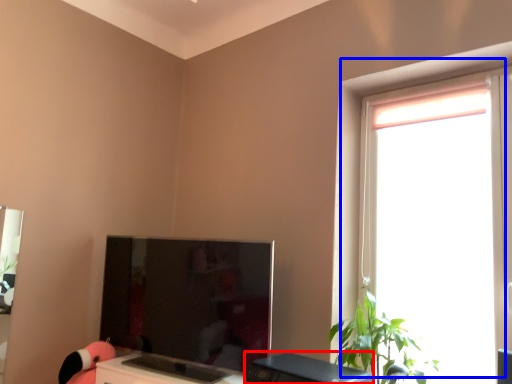
Question: Which of the following is the farthest to the observer, desktop (highlighted by a red box) or window (highlighted by a blue box)?

Choices:
 (A) desktop
 (B) window

Answer: (B)